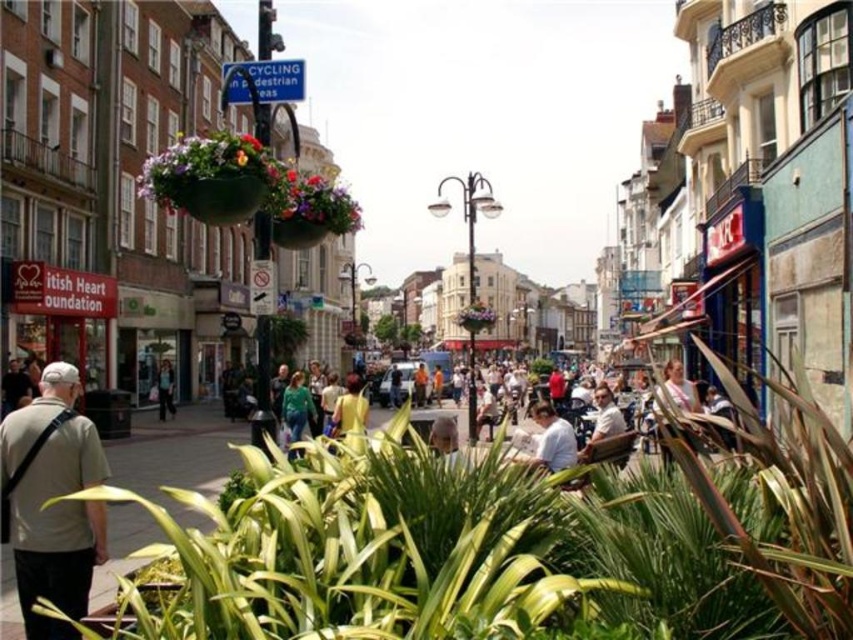
Who is shorter, green fabric shirt at center or yellow fabric at center?

With less height is yellow fabric at center.

Where is `green fabric shirt at center`? green fabric shirt at center is located at coordinates (296, 406).

This screenshot has height=640, width=853. What do you see at coordinates (296, 406) in the screenshot? I see `green fabric shirt at center` at bounding box center [296, 406].

Locate an element on the screen. green fabric shirt at center is located at coordinates (296, 406).

Is khaki cotton shirt at lower left in front of light brown leather jacket at center?

Yes, it is.

Where is `khaki cotton shirt at lower left`? khaki cotton shirt at lower left is located at coordinates (54, 502).

I want to click on khaki cotton shirt at lower left, so click(54, 502).

Is point (775, 435) positioned behind point (26, 563)?

That is True.

Which is above, green leafy plant at lower left or khaki cotton shirt at lower left?

khaki cotton shirt at lower left is above.

This screenshot has height=640, width=853. What do you see at coordinates (511, 541) in the screenshot?
I see `green leafy plant at lower left` at bounding box center [511, 541].

Locate an element on the screen. The image size is (853, 640). green leafy plant at lower left is located at coordinates (511, 541).